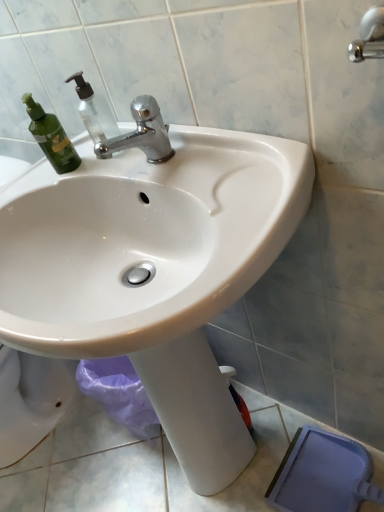
What do you see at coordinates (153, 270) in the screenshot? This screenshot has width=384, height=512. I see `white glossy sink at center` at bounding box center [153, 270].

Locate an element on the screen. This screenshot has width=384, height=512. white glossy sink at center is located at coordinates (153, 270).

Describe the element at coordinates (94, 113) in the screenshot. I see `transparent plastic soap dispenser at upper left` at that location.

The height and width of the screenshot is (512, 384). What are the coordinates of `white glossy sink at center` in the screenshot? It's located at (153, 270).

Who is bigger, transparent plastic soap dispenser at upper left or white glossy sink at center?

white glossy sink at center.

Can you confirm if transparent plastic soap dispenser at upper left is taller than white glossy sink at center?

No, transparent plastic soap dispenser at upper left is not taller than white glossy sink at center.

Which is more to the left, transparent plastic soap dispenser at upper left or white glossy sink at center?

From the viewer's perspective, transparent plastic soap dispenser at upper left appears more on the left side.

From the image's perspective, which is above, transparent plastic soap dispenser at upper left or white glossy sink at center?

transparent plastic soap dispenser at upper left.

From a real-world perspective, who is located higher, transparent plastic soap dispenser at upper left or polished chrome faucet at upper center?

transparent plastic soap dispenser at upper left, from a real-world perspective.

Which is more to the left, transparent plastic soap dispenser at upper left or polished chrome faucet at upper center?

transparent plastic soap dispenser at upper left.

Between transparent plastic soap dispenser at upper left and polished chrome faucet at upper center, which one is positioned in front?

polished chrome faucet at upper center is more forward.

Is polished chrome faucet at upper center completely or partially inside transparent plastic soap dispenser at upper left?

No, polished chrome faucet at upper center is not a part of transparent plastic soap dispenser at upper left.

I want to click on tap on the left of white glossy sink at center, so coord(141,133).

Is polished chrome faucet at upper center bigger than white glossy sink at center?

No.

Is polished chrome faucet at upper center further to camera compared to white glossy sink at center?

That is True.

Who is shorter, white glossy sink at center or transparent plastic soap dispenser at upper left?

transparent plastic soap dispenser at upper left is shorter.

From a real-world perspective, is white glossy sink at center positioned over transparent plastic soap dispenser at upper left based on gravity?

Actually, white glossy sink at center is physically below transparent plastic soap dispenser at upper left in the real world.

Does point (101, 232) come behind point (102, 133)?

That is False.

Which is more to the left, polished chrome faucet at upper center or transparent plastic soap dispenser at upper left?

Positioned to the left is transparent plastic soap dispenser at upper left.

Identify the location of soap dispenser located behind the polished chrome faucet at upper center. This screenshot has height=512, width=384. (94, 113).

Can you confirm if polished chrome faucet at upper center is bigger than transparent plastic soap dispenser at upper left?

Correct, polished chrome faucet at upper center is larger in size than transparent plastic soap dispenser at upper left.

Is point (165, 142) positioned before point (117, 129)?

Yes, point (165, 142) is in front of point (117, 129).

From a real-world perspective, is white glossy sink at center positioned under polished chrome faucet at upper center based on gravity?

Yes.

Looking at their sizes, would you say white glossy sink at center is wider or thinner than polished chrome faucet at upper center?

Clearly, white glossy sink at center has more width compared to polished chrome faucet at upper center.

Based on their sizes in the image, would you say white glossy sink at center is bigger or smaller than polished chrome faucet at upper center?

Clearly, white glossy sink at center is larger in size than polished chrome faucet at upper center.

Which of these two, white glossy sink at center or polished chrome faucet at upper center, stands shorter?

With less height is polished chrome faucet at upper center.

At what (x,y) coordinates should I click in order to perform the action: click on sink that is in front of the transparent plastic soap dispenser at upper left. Please return your answer as a coordinate pair (x, y). Image resolution: width=384 pixels, height=512 pixels. Looking at the image, I should click on (153, 270).

Image resolution: width=384 pixels, height=512 pixels. In the image, there is a transparent plastic soap dispenser at upper left. What are the coordinates of `tap below it (from the image's perspective)` in the screenshot? It's located at (141, 133).

When comparing their distances from white glossy sink at center, does polished chrome faucet at upper center or transparent plastic soap dispenser at upper left seem further?

The object further to white glossy sink at center is transparent plastic soap dispenser at upper left.

Estimate the real-world distances between objects in this image. Which object is closer to transparent plastic soap dispenser at upper left, white glossy sink at center or polished chrome faucet at upper center?

Based on the image, polished chrome faucet at upper center appears to be nearer to transparent plastic soap dispenser at upper left.

Looking at the image, which one is located further to transparent plastic soap dispenser at upper left, polished chrome faucet at upper center or white glossy sink at center?

white glossy sink at center lies further to transparent plastic soap dispenser at upper left than the other object.

Looking at the image, which one is located further to polished chrome faucet at upper center, white glossy sink at center or transparent plastic soap dispenser at upper left?

white glossy sink at center lies further to polished chrome faucet at upper center than the other object.

From the image, which object appears to be nearer to white glossy sink at center, transparent plastic soap dispenser at upper left or polished chrome faucet at upper center?

Based on the image, polished chrome faucet at upper center appears to be nearer to white glossy sink at center.

When comparing their distances from polished chrome faucet at upper center, does transparent plastic soap dispenser at upper left or white glossy sink at center seem closer?

The object closer to polished chrome faucet at upper center is transparent plastic soap dispenser at upper left.

I want to click on tap that lies between transparent plastic soap dispenser at upper left and white glossy sink at center from top to bottom, so click(141, 133).